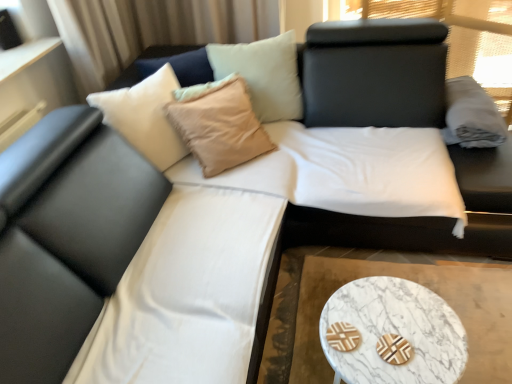
Question: Is black leather bed at center positioned in front of marble/stone coffee table at lower right?

Choices:
 (A) yes
 (B) no

Answer: (B)

Question: Could you tell me if black leather bed at center is facing marble/stone coffee table at lower right?

Choices:
 (A) yes
 (B) no

Answer: (A)

Question: Can you confirm if black leather bed at center is shorter than marble/stone coffee table at lower right?

Choices:
 (A) yes
 (B) no

Answer: (B)

Question: Is black leather bed at center directly adjacent to marble/stone coffee table at lower right?

Choices:
 (A) no
 (B) yes

Answer: (A)

Question: Is marble/stone coffee table at lower right located within black leather bed at center?

Choices:
 (A) yes
 (B) no

Answer: (B)

Question: In terms of width, does gray cotton pillow at upper right look wider or thinner when compared to beige fabric pillow at upper center?

Choices:
 (A) wide
 (B) thin

Answer: (A)

Question: Would you say gray cotton pillow at upper right is to the left or to the right of beige fabric pillow at upper center in the picture?

Choices:
 (A) right
 (B) left

Answer: (A)

Question: From a real-world perspective, relative to beige fabric pillow at upper center, is gray cotton pillow at upper right vertically above or below?

Choices:
 (A) above
 (B) below

Answer: (B)

Question: In terms of height, does gray cotton pillow at upper right look taller or shorter compared to beige fabric pillow at upper center?

Choices:
 (A) tall
 (B) short

Answer: (B)

Question: Is white marble cocktail table at lower right bigger or smaller than gray cotton pillow at upper right?

Choices:
 (A) small
 (B) big

Answer: (B)

Question: Looking at their shapes, would you say white marble cocktail table at lower right is wider or thinner than gray cotton pillow at upper right?

Choices:
 (A) wide
 (B) thin

Answer: (A)

Question: Is white marble cocktail table at lower right to the left or to the right of gray cotton pillow at upper right in the image?

Choices:
 (A) right
 (B) left

Answer: (B)

Question: From a real-world perspective, is white marble cocktail table at lower right positioned above or below gray cotton pillow at upper right?

Choices:
 (A) above
 (B) below

Answer: (B)

Question: From the image's perspective, relative to beige fabric pillow at upper center, is marble/stone coffee table at lower right above or below?

Choices:
 (A) below
 (B) above

Answer: (A)

Question: Is point (408, 365) positioned closer to the camera than point (236, 145)?

Choices:
 (A) farther
 (B) closer

Answer: (B)